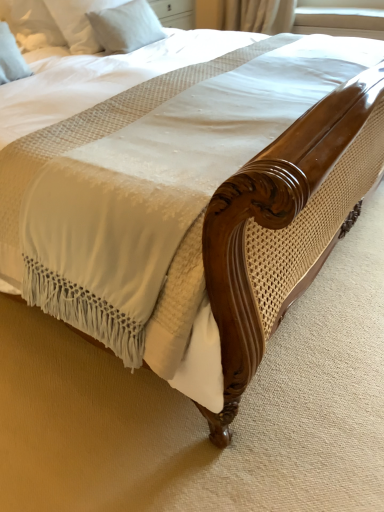
Locate an element on the screen. The height and width of the screenshot is (512, 384). white soft pillow at upper left, which is the 2th pillow in front-to-back order is located at coordinates pos(126,27).

What do you see at coordinates (31, 24) in the screenshot? Image resolution: width=384 pixels, height=512 pixels. I see `white soft pillow at upper left, marked as the first pillow in a front-to-back arrangement` at bounding box center [31, 24].

This screenshot has height=512, width=384. In order to click on white fabric at upper right in this screenshot , I will do [x=341, y=14].

Is white soft pillow at upper left, positioned as the 1th pillow in left-to-right order, completely or partially outside of white fabric at upper right?

Yes, white soft pillow at upper left, positioned as the 1th pillow in left-to-right order, is located beyond the bounds of white fabric at upper right.

In the scene shown: In terms of height, does white soft pillow at upper left, positioned as the 1th pillow in left-to-right order, look taller or shorter compared to white fabric at upper right?

In the image, white soft pillow at upper left, positioned as the 1th pillow in left-to-right order, appears to be taller than white fabric at upper right.

Considering the relative sizes of white soft pillow at upper left, positioned as the 1th pillow in left-to-right order, and white fabric at upper right in the image provided, is white soft pillow at upper left, positioned as the 1th pillow in left-to-right order, thinner than white fabric at upper right?

Correct, the width of white soft pillow at upper left, positioned as the 1th pillow in left-to-right order, is less than that of white fabric at upper right.

Is point (302, 22) closer to viewer compared to point (95, 29)?

No, (302, 22) is further to viewer.

How many degrees apart are the facing directions of white fabric at upper right and white soft pillow at upper left, the first pillow from the back?

95 degrees.

Consider the image. Could you tell me if white fabric at upper right is facing white soft pillow at upper left, marked as the 2th pillow in a left-to-right arrangement?

Yes, white fabric at upper right is oriented towards white soft pillow at upper left, marked as the 2th pillow in a left-to-right arrangement.

From the white fabric at upper right, count 1st pillows forward and point to it. Please provide its 2D coordinates.

[(126, 27)]

Is white soft pillow at upper left, which is the 2th pillow in front-to-back order, oriented towards white fabric at upper right?

No, white soft pillow at upper left, which is the 2th pillow in front-to-back order, is not aimed at white fabric at upper right.

Is point (102, 14) farther from camera compared to point (356, 6)?

No, (102, 14) is in front of (356, 6).

Is white soft pillow at upper left, marked as the 2th pillow in a left-to-right arrangement, not near white fabric at upper right?

Yes, white soft pillow at upper left, marked as the 2th pillow in a left-to-right arrangement, and white fabric at upper right are quite far apart.

Can you confirm if white soft pillow at upper left, marked as the 2th pillow in a left-to-right arrangement, is positioned to the left of white fabric at upper right?

Indeed, white soft pillow at upper left, marked as the 2th pillow in a left-to-right arrangement, is positioned on the left side of white fabric at upper right.

Does white soft pillow at upper left, acting as the first pillow starting from the right, come in front of white soft pillow at upper left, placed as the 2th pillow when sorted from back to front?

No, it is behind white soft pillow at upper left, placed as the 2th pillow when sorted from back to front.

Could you measure the distance between white soft pillow at upper left, acting as the first pillow starting from the right, and white soft pillow at upper left, positioned as the 1th pillow in left-to-right order?

They are 12.94 inches apart.

Which is closer to the camera, [108,33] or [38,40]?

The point [108,33] is in front.

Are white soft pillow at upper left, the first pillow from the back, and white soft pillow at upper left, marked as the first pillow in a front-to-back arrangement, far apart?

No, white soft pillow at upper left, the first pillow from the back, is not far from white soft pillow at upper left, marked as the first pillow in a front-to-back arrangement.

Identify the location of pillow on the right of white soft pillow at upper left, positioned as the 2th pillow in right-to-left order. The image size is (384, 512). (126, 27).

Is white soft pillow at upper left, positioned as the 2th pillow in right-to-left order, facing away from white soft pillow at upper left, the first pillow from the back?

white soft pillow at upper left, positioned as the 2th pillow in right-to-left order, is not turned away from white soft pillow at upper left, the first pillow from the back.

From a real-world perspective, which object stands above the other?

white soft pillow at upper left, positioned as the 1th pillow in left-to-right order.

In the image, is white soft pillow at upper left, marked as the first pillow in a front-to-back arrangement, on the left side or the right side of white soft pillow at upper left, which is the 2th pillow in front-to-back order?

Based on their positions, white soft pillow at upper left, marked as the first pillow in a front-to-back arrangement, is located to the left of white soft pillow at upper left, which is the 2th pillow in front-to-back order.

Is point (297, 20) closer or farther from the camera than point (29, 11)?

Point (297, 20).

Could you tell me if white fabric at upper right is facing white soft pillow at upper left, placed as the 2th pillow when sorted from back to front?

Yes, white fabric at upper right is turned towards white soft pillow at upper left, placed as the 2th pillow when sorted from back to front.

How different are the orientations of white fabric at upper right and white soft pillow at upper left, marked as the first pillow in a front-to-back arrangement, in degrees?

They differ by 91.2 degrees in their facing directions.

Locate an element on the screen. window screen that is above the white soft pillow at upper left, positioned as the 2th pillow in right-to-left order (from the image's perspective) is located at coordinates click(x=341, y=14).

Locate an element on the screen. the 1st pillow to the left of the white fabric at upper right, counting from the anchor's position is located at coordinates (126, 27).

When comparing their distances from white soft pillow at upper left, marked as the first pillow in a front-to-back arrangement, does white fabric at upper right or white soft pillow at upper left, which is the 2th pillow in front-to-back order, seem closer?

white soft pillow at upper left, which is the 2th pillow in front-to-back order, is closer to white soft pillow at upper left, marked as the first pillow in a front-to-back arrangement.

Considering their positions, is white soft pillow at upper left, acting as the first pillow starting from the right, positioned further to white fabric at upper right than white soft pillow at upper left, marked as the first pillow in a front-to-back arrangement?

white soft pillow at upper left, marked as the first pillow in a front-to-back arrangement.

When comparing their distances from white soft pillow at upper left, marked as the 2th pillow in a left-to-right arrangement, does white fabric at upper right or white soft pillow at upper left, positioned as the 2th pillow in right-to-left order, seem further?

white fabric at upper right.

Based on their spatial positions, is white soft pillow at upper left, marked as the first pillow in a front-to-back arrangement, or white fabric at upper right closer to white soft pillow at upper left, which is the 2th pillow in front-to-back order?

white soft pillow at upper left, marked as the first pillow in a front-to-back arrangement.

Consider the image. When comparing their distances from white fabric at upper right, does white soft pillow at upper left, marked as the first pillow in a front-to-back arrangement, or white soft pillow at upper left, acting as the first pillow starting from the right, seem further?

white soft pillow at upper left, marked as the first pillow in a front-to-back arrangement, is further to white fabric at upper right.

When comparing their distances from white soft pillow at upper left, positioned as the 1th pillow in left-to-right order, does white soft pillow at upper left, marked as the 2th pillow in a left-to-right arrangement, or white fabric at upper right seem further?

Among the two, white fabric at upper right is located further to white soft pillow at upper left, positioned as the 1th pillow in left-to-right order.

I want to click on pillow located between white soft pillow at upper left, positioned as the 1th pillow in left-to-right order, and white fabric at upper right in the left-right direction, so click(x=126, y=27).